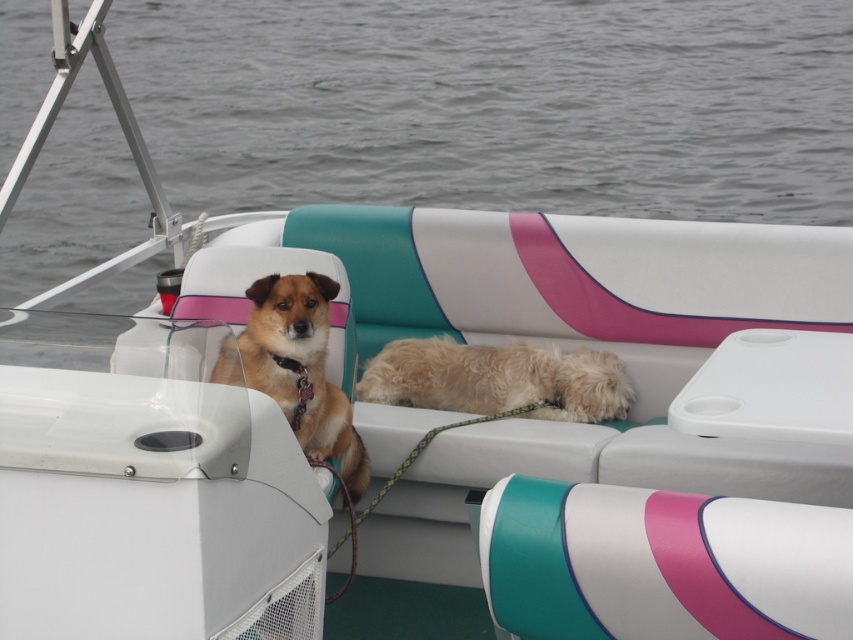
Question: Which point is closer to the camera?

Choices:
 (A) (326, 426)
 (B) (402, 348)

Answer: (A)

Question: Which of the following is the closest to the observer?

Choices:
 (A) (503, 348)
 (B) (323, 328)

Answer: (B)

Question: In this image, where is fuzzy beige dog at center located relative to brown furry dog at center?

Choices:
 (A) right
 (B) left

Answer: (A)

Question: Is fuzzy beige dog at center further to the viewer compared to brown furry dog at center?

Choices:
 (A) no
 (B) yes

Answer: (B)

Question: Can you confirm if fuzzy beige dog at center is smaller than brown furry dog at center?

Choices:
 (A) no
 (B) yes

Answer: (B)